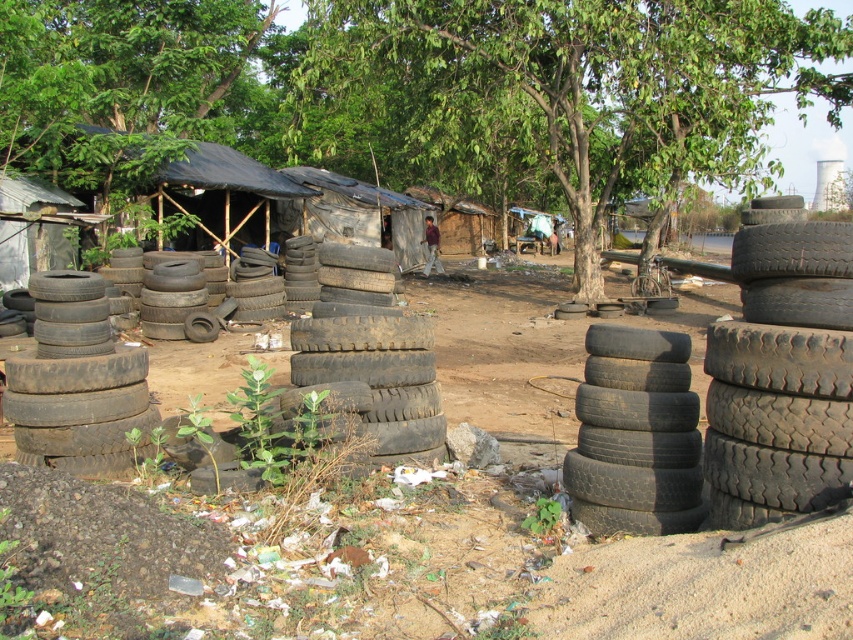
In the scene shown: You are standing at the center of the scene and see a point marked at coordinates (635,435). What object is this point located on?

The point is located on dark grey rubber tires at right.

You are a delivery person trying to navigate through the area. You need to move from the right side of the image to the left side. There are dark grey rubber tires at right and black rubber tires at center in your path. Which set of tires should you move around to avoid obstacles?

You should move around the dark grey rubber tires at right first since they are in front of the black rubber tires at center and would block your path first.